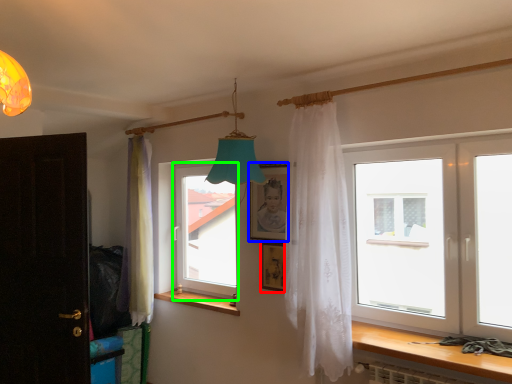
Question: Which is nearer to the picture frame (highlighted by a red box)? picture frame (highlighted by a blue box) or window (highlighted by a green box).

Choices:
 (A) picture frame
 (B) window

Answer: (A)